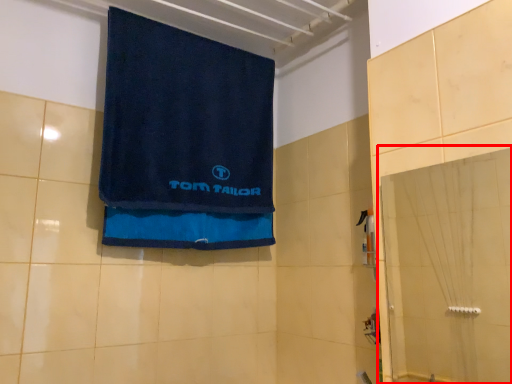
Question: From the image's perspective, where is glass door (annotated by the red box) located relative to towel?

Choices:
 (A) below
 (B) above

Answer: (A)